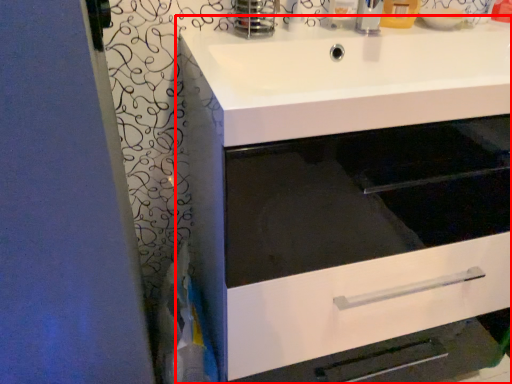
Question: Observing the image, what is the correct spatial positioning of bathroom cabinet (annotated by the red box) in reference to sink?

Choices:
 (A) left
 (B) right

Answer: (A)